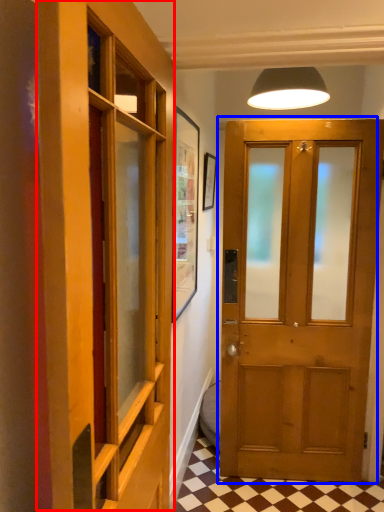
Question: Which object is further to the camera taking this photo, elevator (highlighted by a red box) or door (highlighted by a blue box)?

Choices:
 (A) elevator
 (B) door

Answer: (B)